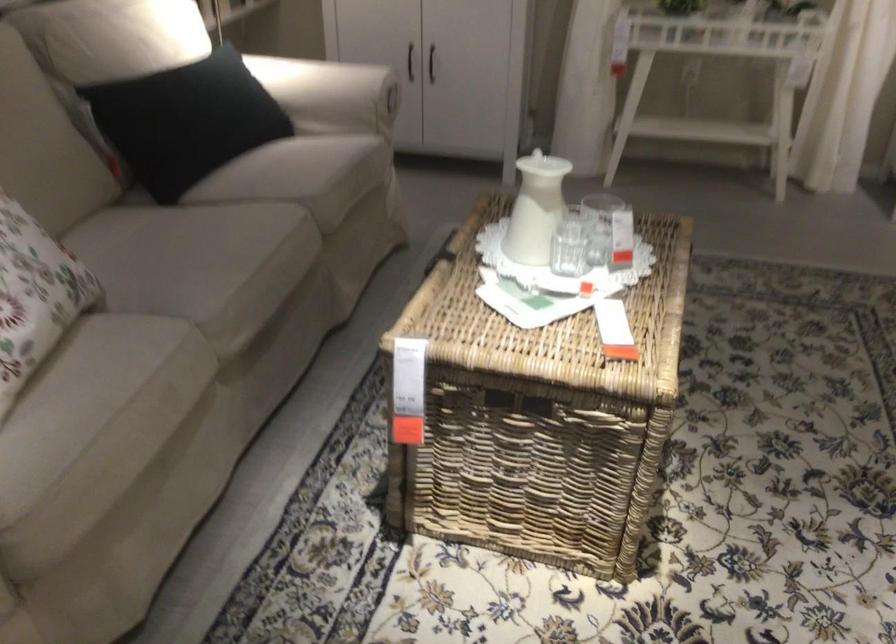
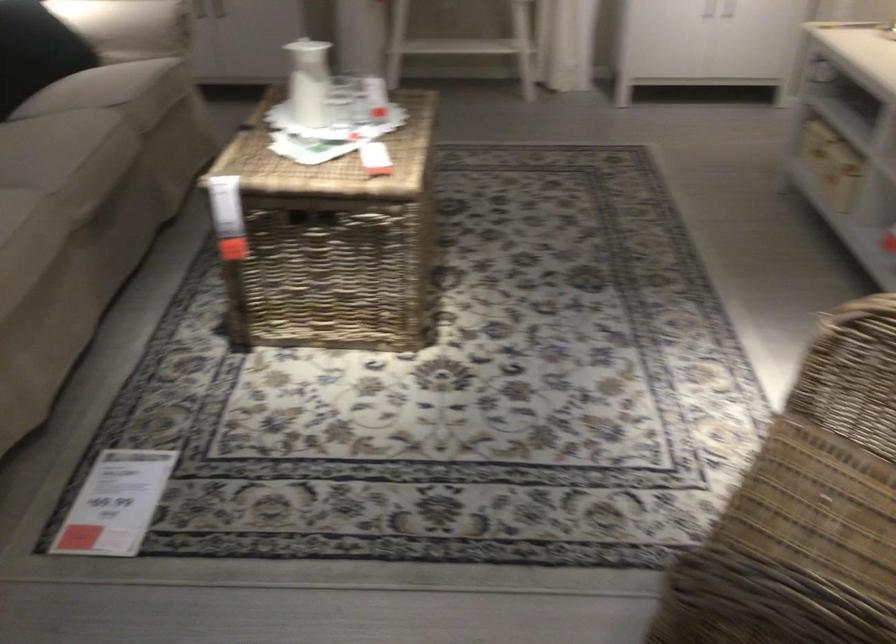
In the second image, find the point that corresponds to [526,207] in the first image.

(308, 82)